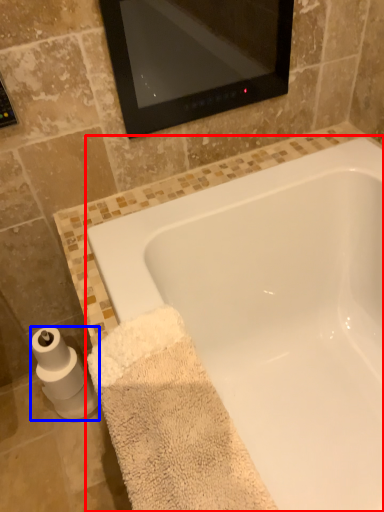
Question: Among these objects, which one is farthest to the camera, bathtub (highlighted by a red box) or toilet paper (highlighted by a blue box)?

Choices:
 (A) bathtub
 (B) toilet paper

Answer: (B)